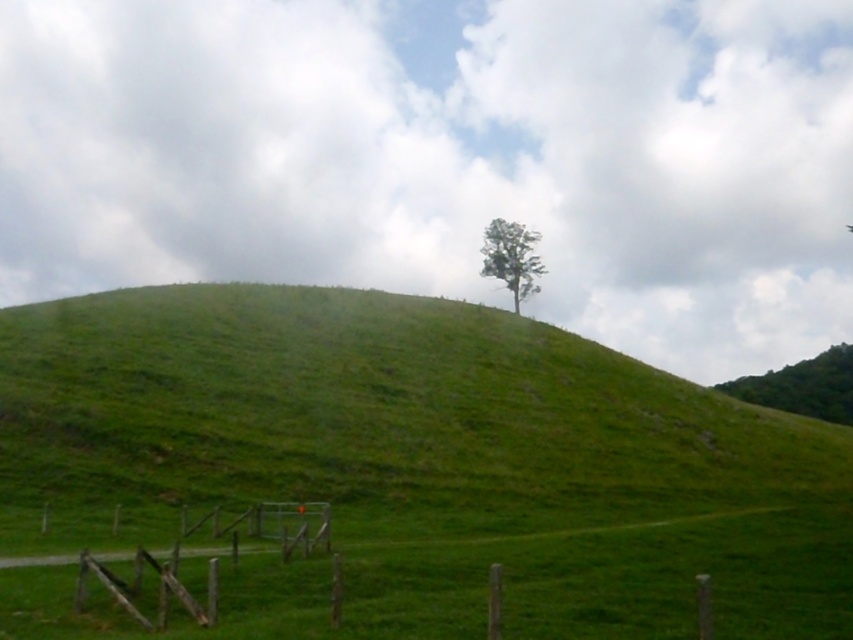
Question: Does brown wooden fence at lower left come in front of green leafy tree at upper right?

Choices:
 (A) yes
 (B) no

Answer: (A)

Question: Does green leafy tree at upper right lie in front of green leafy tree at center?

Choices:
 (A) yes
 (B) no

Answer: (B)

Question: Which of these objects is positioned closest to the green leafy tree at upper right?

Choices:
 (A) green leafy tree at center
 (B) green grassy hillside at center

Answer: (A)

Question: Which object is farther from the camera taking this photo?

Choices:
 (A) green leafy tree at center
 (B) brown wooden fence at lower left
 (C) green grassy hillside at center

Answer: (A)

Question: Can you confirm if brown wooden fence at lower left is positioned above green leafy tree at upper right?

Choices:
 (A) no
 (B) yes

Answer: (B)

Question: Which of these objects is positioned closest to the green grassy hillside at center?

Choices:
 (A) green leafy tree at upper right
 (B) green leafy tree at center
 (C) brown wooden fence at lower left

Answer: (C)